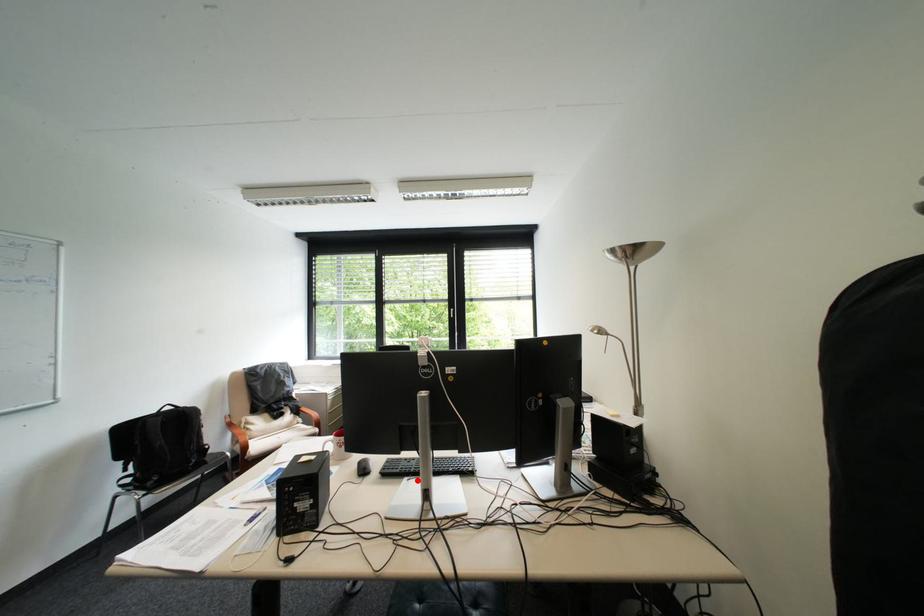
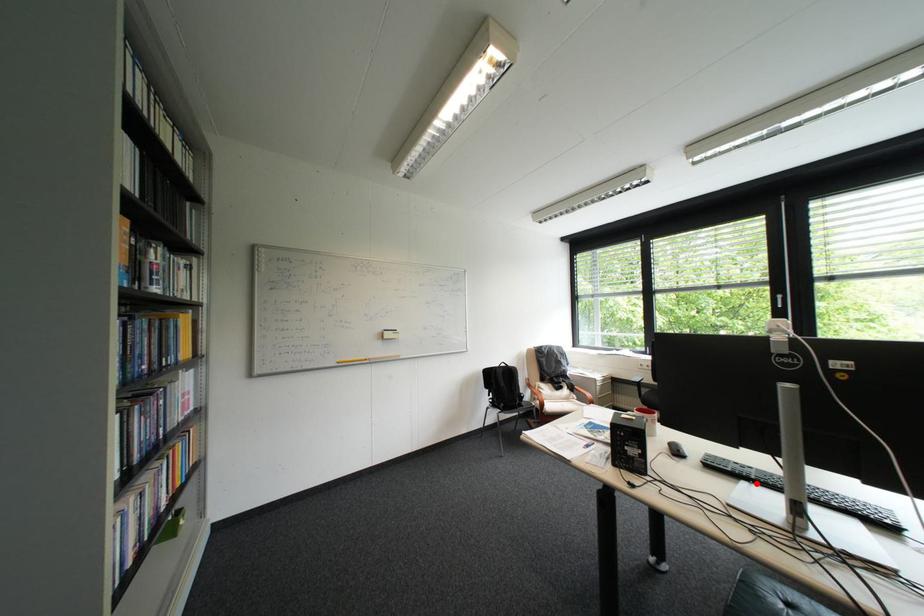
I am providing you with two images of the same scene from different viewpoints. A red point is marked on the first image and another point is marked on the second image. Do the highlighted points in image1 and image2 indicate the same real-world spot?

Yes